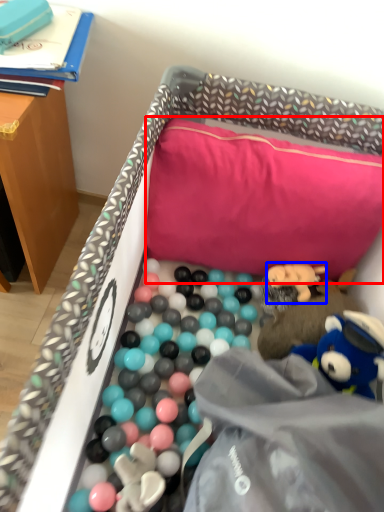
Question: Which object is further to the camera taking this photo, pillow (highlighted by a red box) or toy (highlighted by a blue box)?

Choices:
 (A) pillow
 (B) toy

Answer: (B)